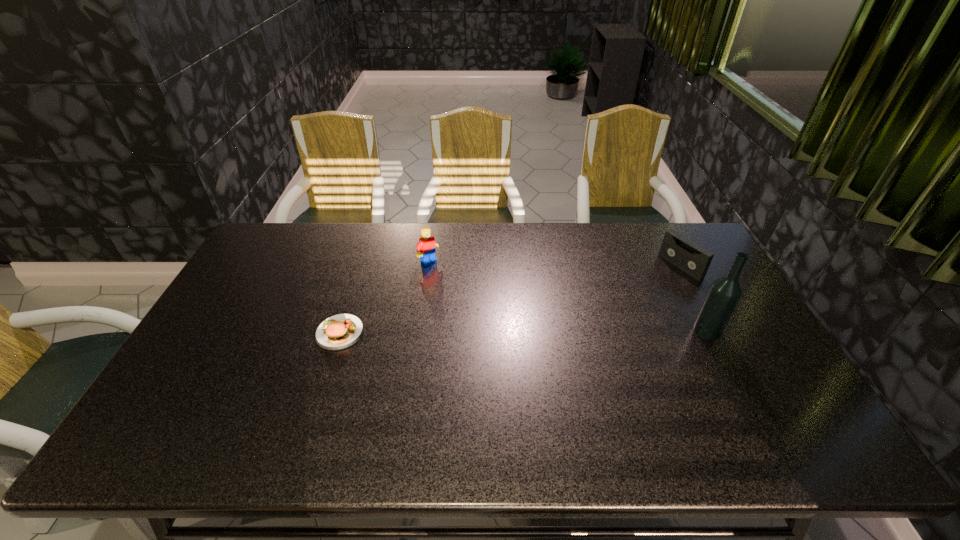
Where is `the shortest object`? The width and height of the screenshot is (960, 540). the shortest object is located at coordinates (x=340, y=331).

This screenshot has height=540, width=960. I want to click on patty, so click(340, 331).

Where is `the tallest object`? The width and height of the screenshot is (960, 540). the tallest object is located at coordinates (725, 292).

This screenshot has height=540, width=960. Identify the location of the third tallest object. (677, 249).

Find the location of a particular element. The image size is (960, 540). the second object from left to right is located at coordinates (426, 249).

Locate an element on the screen. This screenshot has width=960, height=540. the second tallest object is located at coordinates (426, 249).

Locate an element on the screen. The width and height of the screenshot is (960, 540). free region located 0.190m on the left of the patty is located at coordinates (250, 333).

This screenshot has height=540, width=960. Find the location of `vacant space located on the left of the vodka`. vacant space located on the left of the vodka is located at coordinates (652, 331).

This screenshot has height=540, width=960. In order to click on vacant region located 0.230m on the front-facing side of the videotape in this screenshot , I will do `click(621, 301)`.

I want to click on vacant position located 0.230m on the front-facing side of the videotape, so click(621, 301).